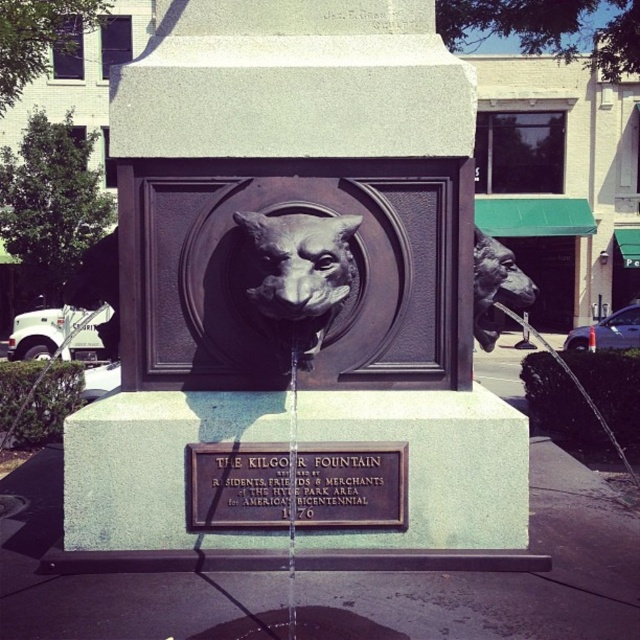
Which of these two, bronze plaque at center or bronze statue at right, stands taller?

bronze statue at right

Is point (241, 456) closer to viewer compared to point (493, 330)?

Yes, point (241, 456) is closer to viewer.

Find the location of `bronze plaque at center`. bronze plaque at center is located at coordinates (296, 484).

Can you confirm if bronze statue at center is positioned to the left of bronze statue at right?

Correct, you'll find bronze statue at center to the left of bronze statue at right.

Is bronze statue at center wider than bronze statue at right?

Correct, the width of bronze statue at center exceeds that of bronze statue at right.

Identify the location of bronze statue at center. (294, 300).

This screenshot has width=640, height=640. What are the coordinates of `bronze statue at center` in the screenshot? It's located at (294, 300).

Can you confirm if bronze statue at center is wider than bronze/textured animal head at center?

Yes.

Who is positioned more to the left, bronze statue at center or bronze/textured animal head at center?

bronze statue at center

Is point (259, 292) closer to viewer compared to point (282, 324)?

Yes, it is.

Where is `bronze statue at center`? This screenshot has height=640, width=640. bronze statue at center is located at coordinates (294, 300).